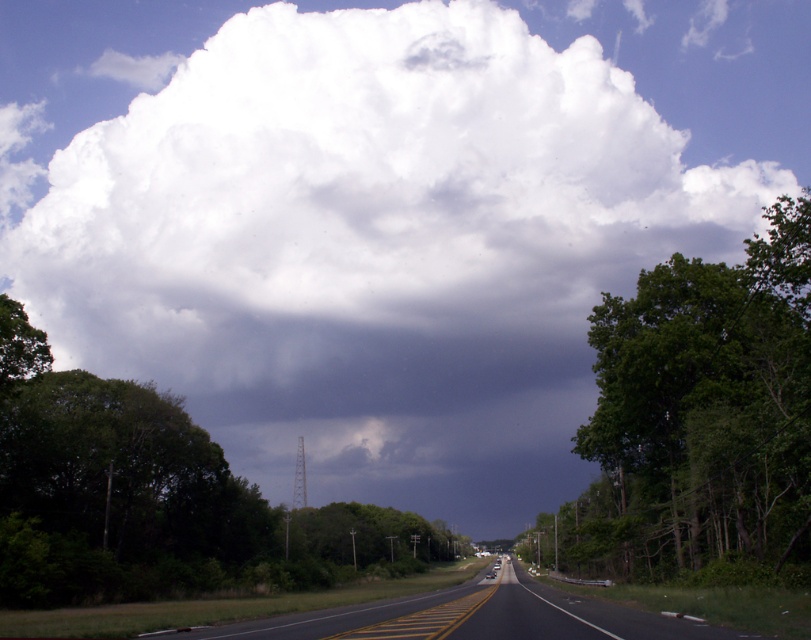
Question: Which of the following is the closest to the observer?

Choices:
 (A) black asphalt highway at center
 (B) green leafy tree at right
 (C) green leafy tree at left

Answer: (A)

Question: Which of the following is the closest to the observer?

Choices:
 (A) green leafy tree at right
 (B) green leafy tree at left

Answer: (A)

Question: Is green leafy tree at right wider than black asphalt highway at center?

Choices:
 (A) no
 (B) yes

Answer: (B)

Question: Does green leafy tree at left appear on the left side of black asphalt highway at center?

Choices:
 (A) no
 (B) yes

Answer: (B)

Question: Which point appears farthest from the camera in this image?

Choices:
 (A) (470, 628)
 (B) (710, 346)

Answer: (B)

Question: Is green leafy tree at left positioned before black asphalt highway at center?

Choices:
 (A) no
 (B) yes

Answer: (A)